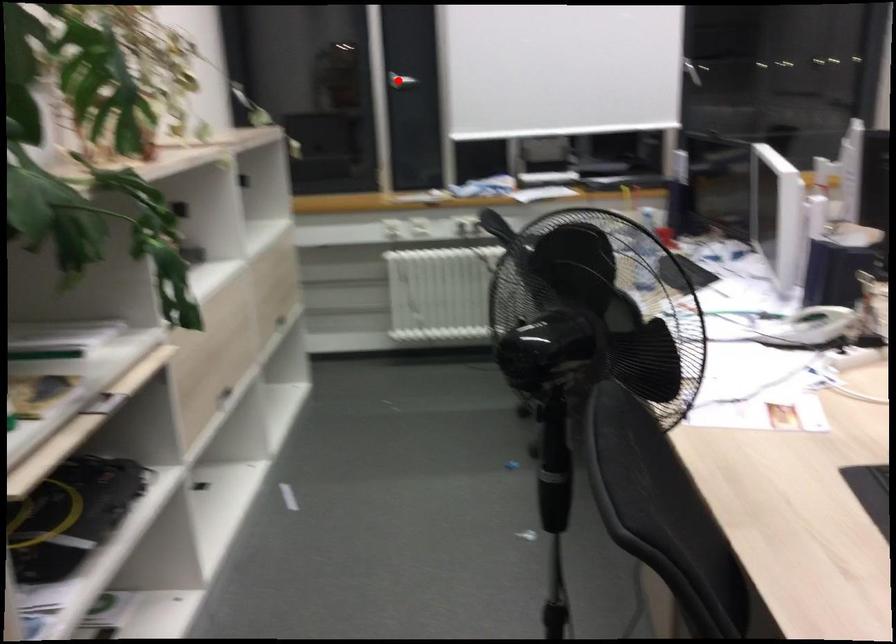
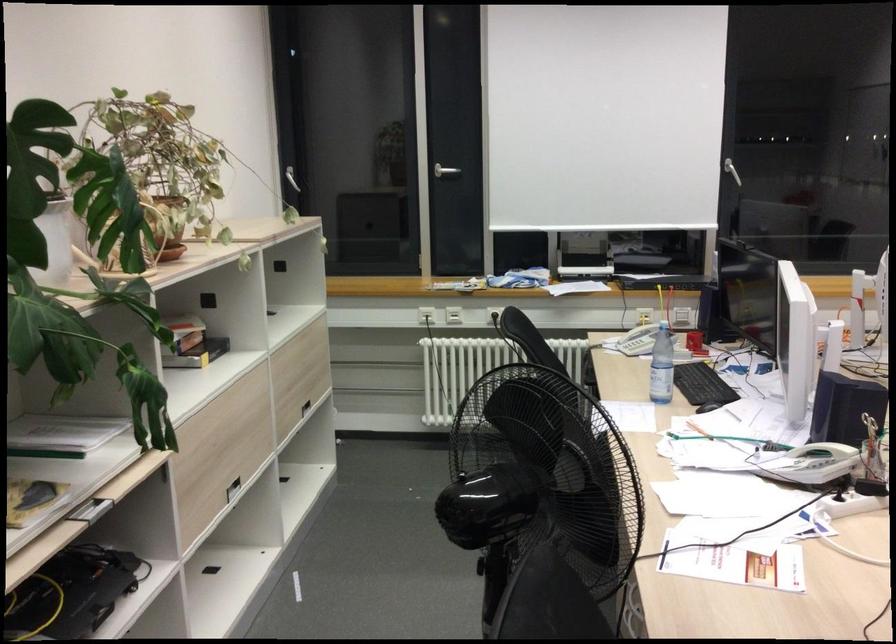
Find the pixel in the second image that matches the highlighted location in the first image.

(445, 171)